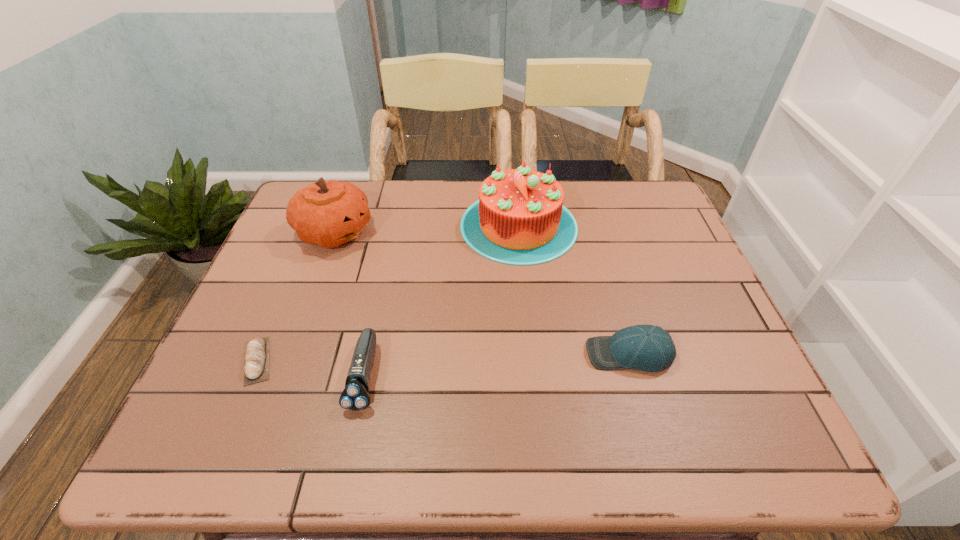
The height and width of the screenshot is (540, 960). I want to click on free point between the shortest object and the baseball cap, so click(x=444, y=357).

Where is `free space between the third object from left to right and the shortest object`? free space between the third object from left to right and the shortest object is located at coordinates (311, 368).

Where is `object that is the fourth closest to the third object from left to right`? object that is the fourth closest to the third object from left to right is located at coordinates (650, 348).

Choose which object is the nearest neighbor to the cake. Please provide its 2D coordinates. Your answer should be formatted as a tuple, i.e. [(x, y)], where the tuple contains the x and y coordinates of a point satisfying the conditions above.

[(650, 348)]

Locate an element on the screen. vacant space that satisfies the following two spatial constraints: 1. on the front-facing side of the baseball cap; 2. on the right side of the pumpkin is located at coordinates (290, 354).